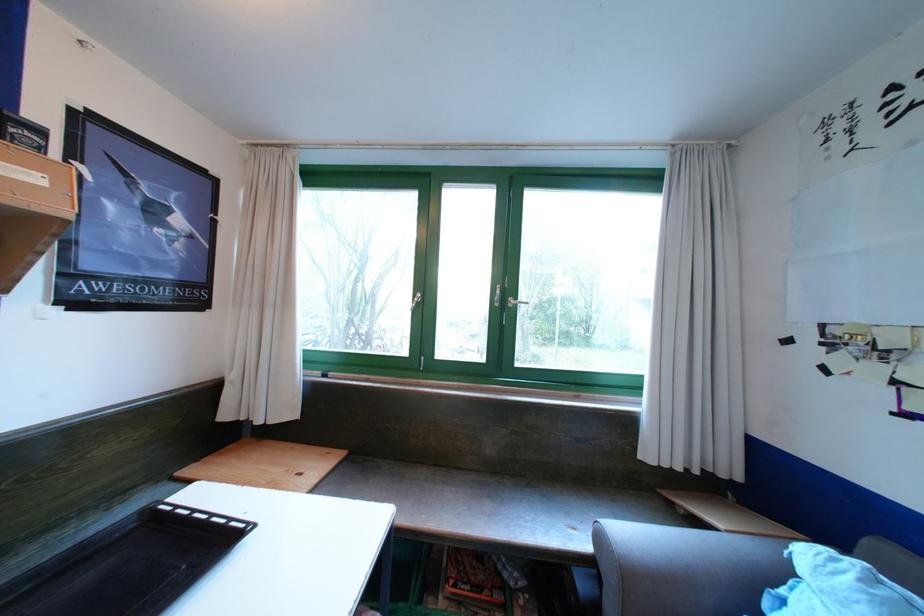
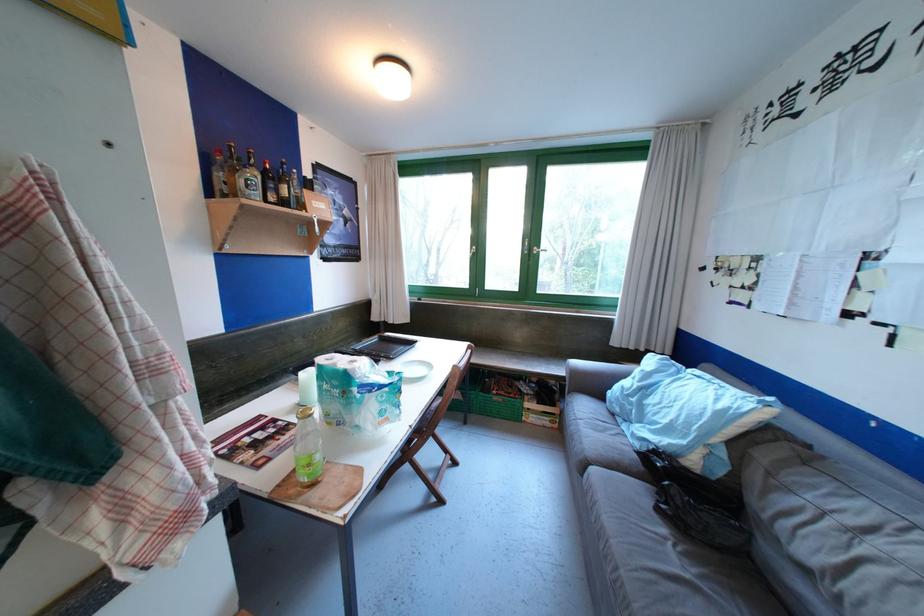
Find the pixel in the second image that matches the point at 91,513 in the first image.

(348, 349)